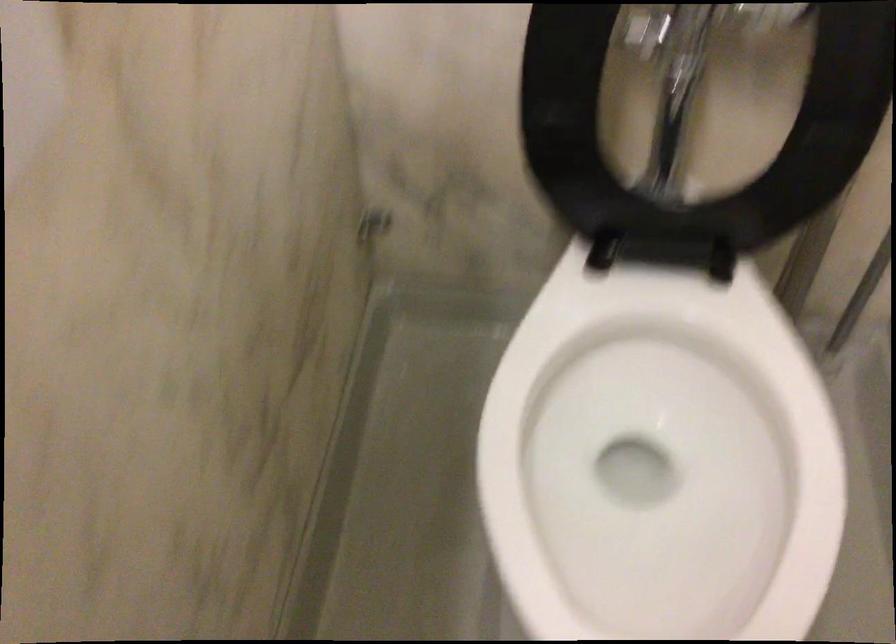
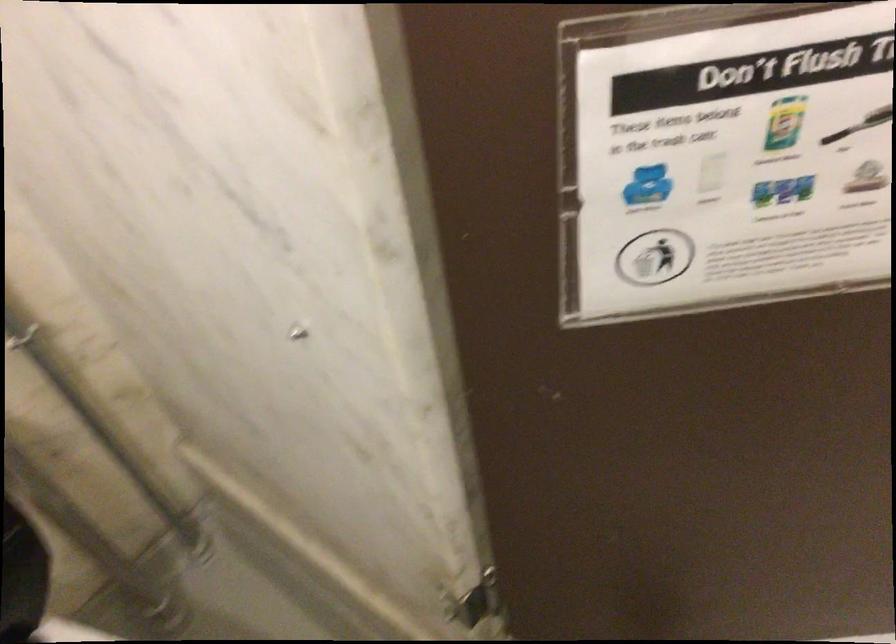
Question: Based on the continuous images, in which direction is the camera rotating? Reply with the corresponding letter.

Choices:
 (A) Left
 (B) Right
 (C) Up
 (D) Down

Answer: (B)